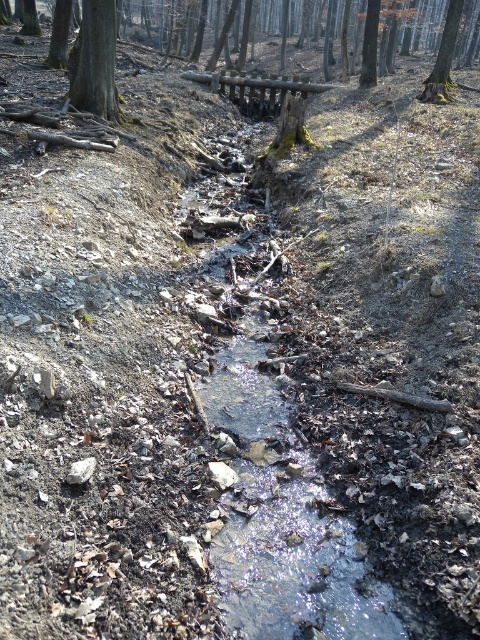
Question: Does smooth brown tree trunk at upper left appear under green mossy tree at upper center?

Choices:
 (A) yes
 (B) no

Answer: (A)

Question: Is smooth brown tree trunk at upper left thinner than green mossy tree at upper center?

Choices:
 (A) yes
 (B) no

Answer: (A)

Question: Considering the relative positions of smooth brown tree trunk at upper left and green mossy tree at upper center in the image provided, where is smooth brown tree trunk at upper left located with respect to green mossy tree at upper center?

Choices:
 (A) right
 (B) left

Answer: (B)

Question: Which object appears farthest from the camera in this image?

Choices:
 (A) green mossy tree at upper center
 (B) smooth brown tree trunk at upper left

Answer: (A)

Question: Which point is farther to the camera?

Choices:
 (A) (112, 56)
 (B) (445, 33)

Answer: (B)

Question: Which of the following is the closest to the observer?

Choices:
 (A) (455, 36)
 (B) (96, 74)

Answer: (B)